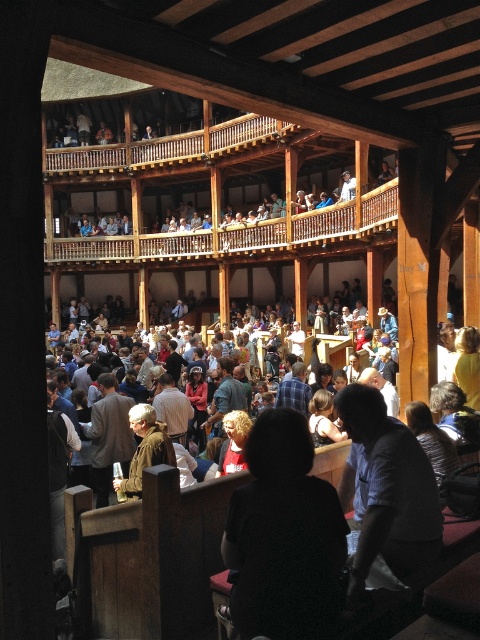
This screenshot has height=640, width=480. Describe the element at coordinates (283, 536) in the screenshot. I see `dark brown hair at center` at that location.

Who is more distant from viewer, (285, 502) or (346, 474)?

Positioned behind is point (346, 474).

Between point (266, 512) and point (363, 408), which one is positioned in front?

Point (266, 512) is more forward.

You are a GUI agent. You are given a task and a screenshot of the screen. Output one action in this format:
    pyautogui.click(x=<x>, y=<y>)
    Task: Click on the dark brown hair at center
    Image resolution: width=480 pixels, height=640 pixels.
    Given the screenshot: What is the action you would take?
    pyautogui.click(x=283, y=536)

Looking at this image, who is taller, blue shirt at lower right or plaid shirt at center?

Standing taller between the two is blue shirt at lower right.

Between point (433, 538) and point (301, 408), which one is positioned behind?

Point (301, 408)

Who is more forward, (x=410, y=529) or (x=307, y=412)?

Positioned in front is point (x=410, y=529).

Image resolution: width=480 pixels, height=640 pixels. I want to click on blue shirt at lower right, so click(385, 490).

Is brown leather jacket at lower left above leather jacket at center?

Indeed, brown leather jacket at lower left is positioned over leather jacket at center.

Image resolution: width=480 pixels, height=640 pixels. Describe the element at coordinates (108, 436) in the screenshot. I see `brown leather jacket at lower left` at that location.

Is point (97, 460) farther from viewer compared to point (170, 461)?

Yes.

The image size is (480, 640). What are the coordinates of `brown leather jacket at lower left` in the screenshot? It's located at (108, 436).